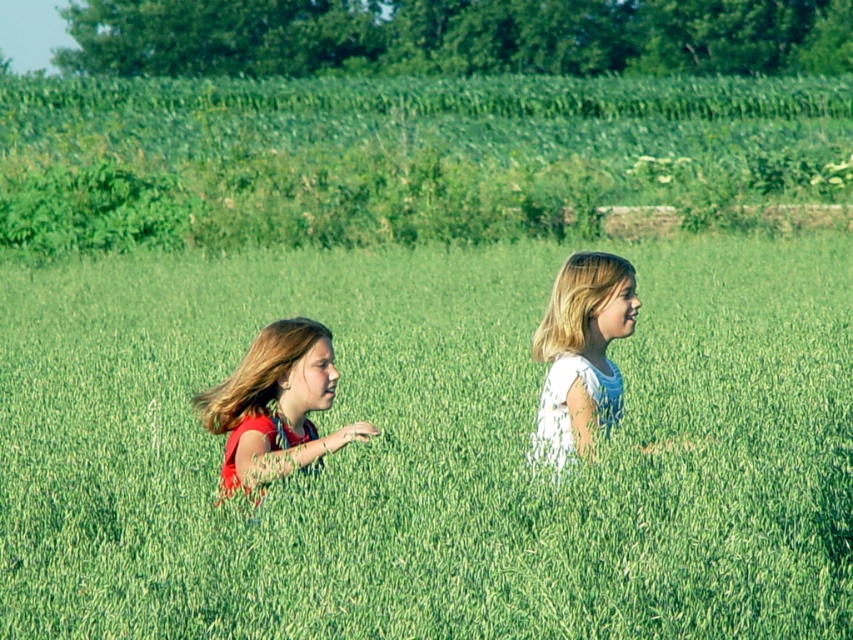
Can you confirm if green grass at center is positioned below white lace dress at center?

No, green grass at center is not below white lace dress at center.

Between point (389, 598) and point (622, 316), which one is positioned behind?

The point (622, 316) is more distant.

Locate an element on the screen. This screenshot has width=853, height=640. green grass at center is located at coordinates (431, 449).

Image resolution: width=853 pixels, height=640 pixels. I want to click on matte red shirt at left, so click(x=276, y=404).

You are a GUI agent. You are given a task and a screenshot of the screen. Output one action in this format:
    pyautogui.click(x=<x>, y=<y>)
    Task: Click on the matte red shirt at left
    This screenshot has height=640, width=853.
    Given the screenshot: What is the action you would take?
    pyautogui.click(x=276, y=404)

Is green grass at center wider than matte red shirt at left?

Yes.

Does green grass at center appear over matte red shirt at left?

Yes.

You are a GUI agent. You are given a task and a screenshot of the screen. Output one action in this format:
    pyautogui.click(x=<x>, y=<y>)
    Task: Click on the green grass at center
    This screenshot has width=853, height=640.
    Given the screenshot: What is the action you would take?
    pyautogui.click(x=431, y=449)

Identify the location of green grass at center. (431, 449).